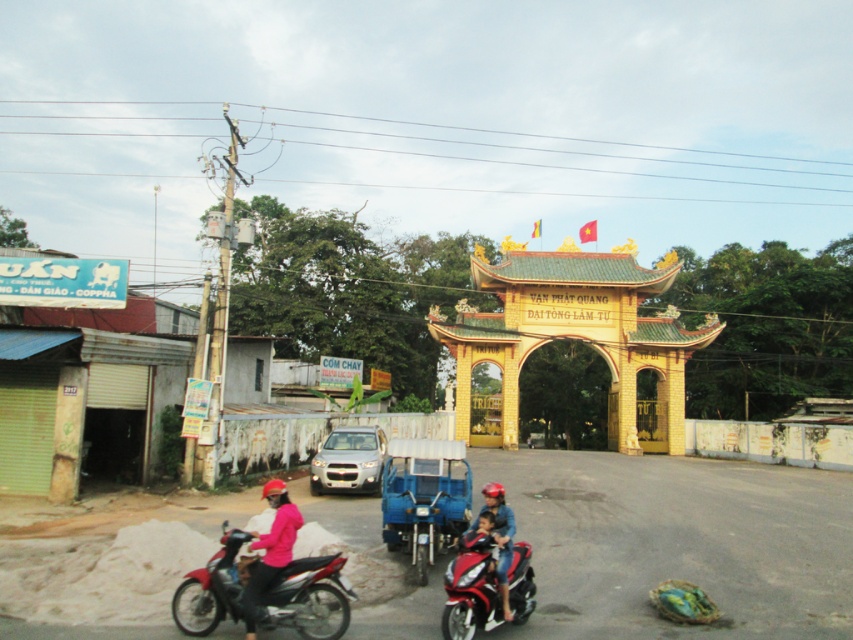
Question: Estimate the real-world distances between objects in this image. Which object is closer to the pink matte jacket at lower center?

Choices:
 (A) shiny red motorcycle at lower center
 (B) matte pink helmet at center
 (C) shiny red motorcycle at lower left

Answer: (C)

Question: Based on their relative distances, which object is farther from the shiny red motorcycle at lower left?

Choices:
 (A) shiny red motorcycle at lower center
 (B) matte pink helmet at center
 (C) pink matte jacket at lower center

Answer: (B)

Question: Does shiny red motorcycle at lower left appear on the left side of pink matte jacket at lower center?

Choices:
 (A) no
 (B) yes

Answer: (A)

Question: Does shiny red motorcycle at lower left appear over pink matte jacket at lower center?

Choices:
 (A) yes
 (B) no

Answer: (A)

Question: Which object is positioned closest to the matte pink helmet at center?

Choices:
 (A) shiny red motorcycle at lower center
 (B) pink matte jacket at lower center
 (C) shiny red motorcycle at lower left

Answer: (A)

Question: Can you confirm if shiny red motorcycle at lower left is smaller than matte pink helmet at center?

Choices:
 (A) yes
 (B) no

Answer: (A)